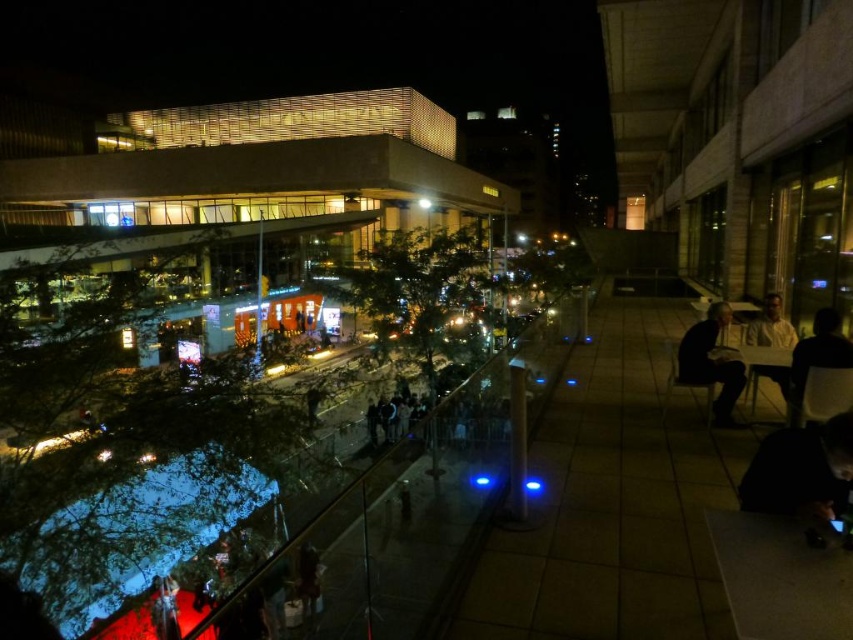
Who is more distant from viewer, (x=791, y=484) or (x=706, y=339)?

The point (x=706, y=339) is more distant.

Between point (819, 433) and point (720, 388), which one is positioned behind?

The point (720, 388) is more distant.

This screenshot has width=853, height=640. In order to click on dark fabric bag at lower right in this screenshot , I will do `click(801, 472)`.

Can you confirm if dark brown leather chair at right is smaller than white matte shirt at right?

Incorrect, dark brown leather chair at right is not smaller in size than white matte shirt at right.

Is dark brown leather chair at right closer to camera compared to white matte shirt at right?

Yes, it is.

The height and width of the screenshot is (640, 853). In order to click on dark brown leather chair at right in this screenshot , I will do `click(817, 355)`.

Locate an element on the screen. The height and width of the screenshot is (640, 853). dark brown leather chair at right is located at coordinates (817, 355).

Can you confirm if matte glass building at center is bigger than dark gray fabric jacket at right?

Correct, matte glass building at center is larger in size than dark gray fabric jacket at right.

From the picture: Is matte glass building at center further to the viewer compared to dark gray fabric jacket at right?

Yes, matte glass building at center is further from the viewer.

Is point (170, 204) farther from viewer compared to point (692, 340)?

Yes, it is.

You are a GUI agent. You are given a task and a screenshot of the screen. Output one action in this format:
    pyautogui.click(x=<x>, y=<y>)
    Task: Click on the matte glass building at center
    The image size is (853, 640).
    Given the screenshot: What is the action you would take?
    pyautogui.click(x=263, y=166)